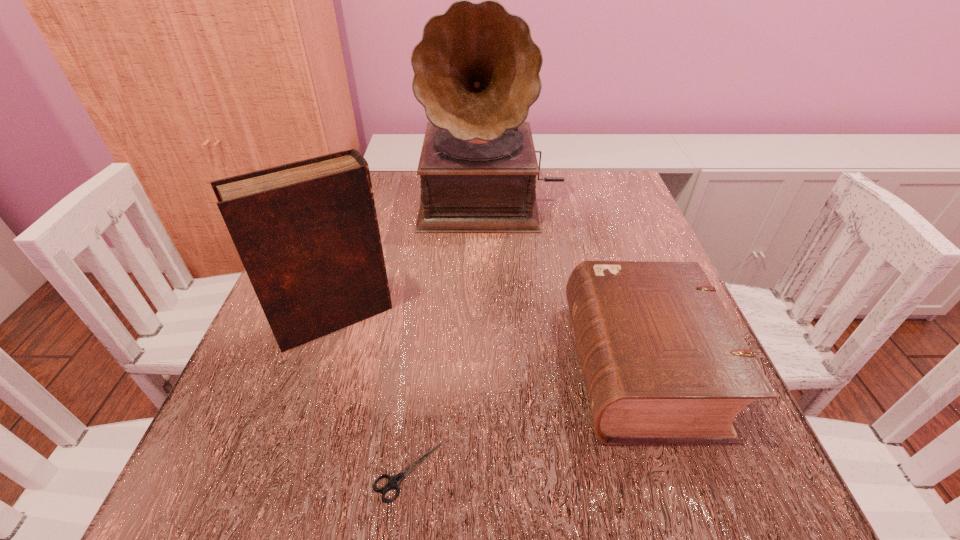
This screenshot has width=960, height=540. In order to click on the farthest object in this screenshot , I will do `click(476, 69)`.

Find the location of a particular element. record player is located at coordinates (476, 69).

Locate an element on the screen. The width and height of the screenshot is (960, 540). the taller Bible is located at coordinates (307, 233).

You are a GUI agent. You are given a task and a screenshot of the screen. Output one action in this format:
    pyautogui.click(x=<x>, y=<y>)
    Task: Click on the second tallest object
    
    Given the screenshot: What is the action you would take?
    pyautogui.click(x=307, y=233)

Find the location of a particular element. The height and width of the screenshot is (540, 960). the shorter Bible is located at coordinates (663, 362).

I want to click on the right Bible, so click(663, 362).

Where is `shears`? shears is located at coordinates (394, 481).

Where is `blank space located 0.130m from the horn of the record player`? The height and width of the screenshot is (540, 960). blank space located 0.130m from the horn of the record player is located at coordinates (494, 272).

This screenshot has height=540, width=960. I want to click on free space located 0.210m on the right of the taller Bible, so click(x=510, y=318).

Where is `blank space located on the spine side of the right Bible`? This screenshot has width=960, height=540. blank space located on the spine side of the right Bible is located at coordinates (422, 366).